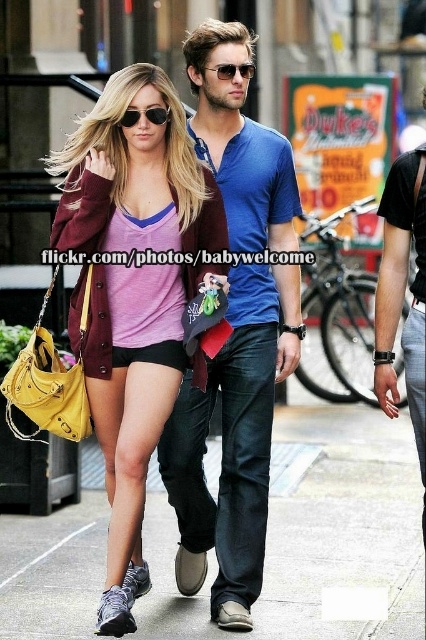
Question: Which point is farther to the camera?

Choices:
 (A) sunglasses at center
 (B) matte black sunglasses at upper center

Answer: (A)

Question: Among these objects, which one is farthest from the camera?

Choices:
 (A) gray concrete pavement at lower center
 (B) blue cotton shirt at center
 (C) sunglasses at center

Answer: (C)

Question: Which point is closer to the camera?

Choices:
 (A) (175, 323)
 (B) (126, 116)

Answer: (B)

Question: Can you confirm if gray concrete pavement at lower center is thinner than sunglasses at center?

Choices:
 (A) yes
 (B) no

Answer: (B)

Question: Observing the image, what is the correct spatial positioning of gray concrete pavement at lower center in reference to blue cotton shirt at center?

Choices:
 (A) above
 (B) below

Answer: (B)

Question: Does blue cotton shirt at center appear over matte black sunglasses at upper center?

Choices:
 (A) yes
 (B) no

Answer: (B)